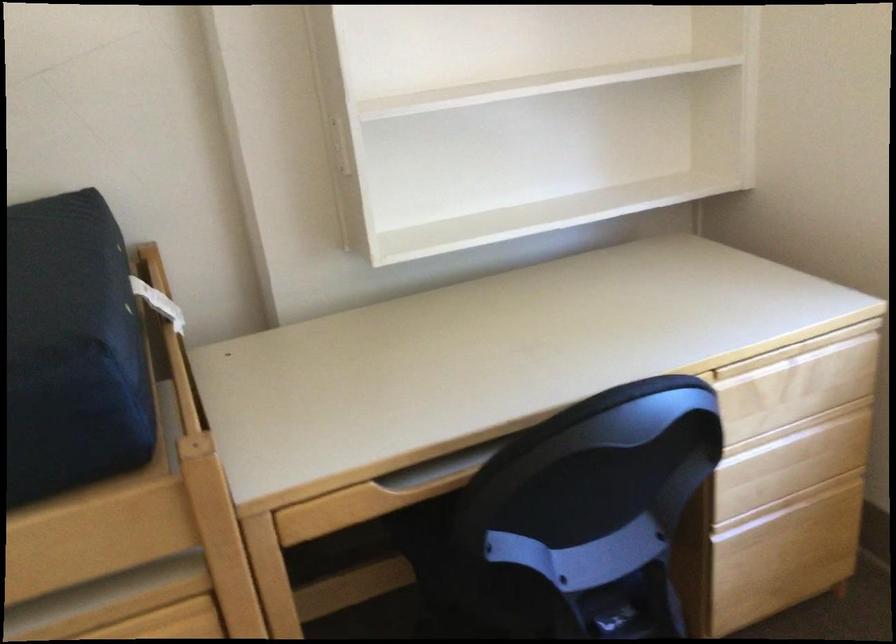
Image resolution: width=896 pixels, height=644 pixels. What do you see at coordinates (431, 489) in the screenshot? I see `the integrated drawer handle` at bounding box center [431, 489].